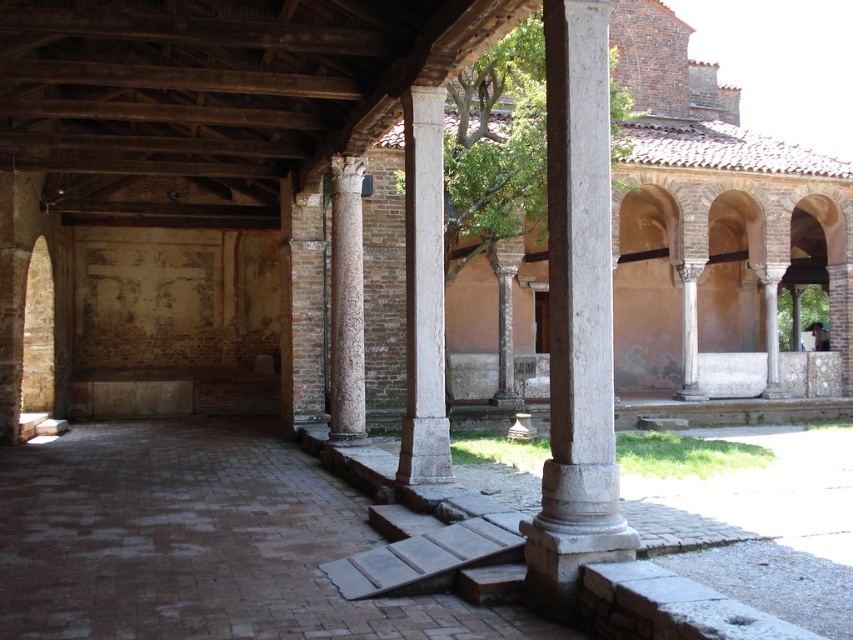
Question: Does smooth stone column at center appear on the left side of white stone column at center?

Choices:
 (A) no
 (B) yes

Answer: (A)

Question: Which point is farther from the camera taking this photo?

Choices:
 (A) (405, 451)
 (B) (344, 435)
 (C) (572, 76)

Answer: (B)

Question: Estimate the real-world distances between objects in this image. Which object is farther from the white stone column at center?

Choices:
 (A) smooth stone column at center
 (B) brown textured column at center

Answer: (B)

Question: Is white stone column at center positioned behind brown textured column at center?

Choices:
 (A) no
 (B) yes

Answer: (A)

Question: Which object is closer to the camera taking this photo?

Choices:
 (A) smooth stone column at center
 (B) brown textured column at center
 (C) white stone column at center

Answer: (A)

Question: In this image, where is smooth stone column at center located relative to white stone column at center?

Choices:
 (A) left
 (B) right

Answer: (B)